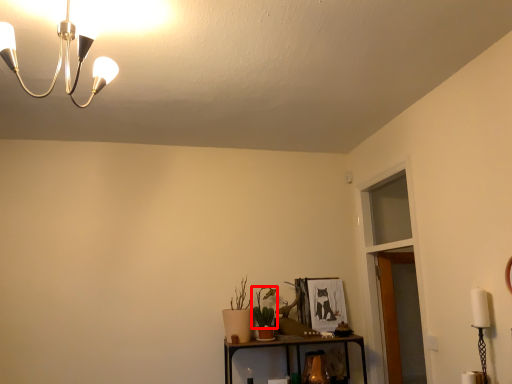
Question: Considering the relative positions of plant (annotated by the red box) and glass door in the image provided, where is plant (annotated by the red box) located with respect to the staircase?

Choices:
 (A) left
 (B) right

Answer: (A)